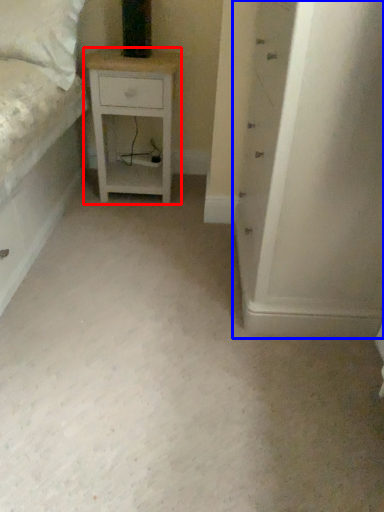
Question: Which point is closer to the camera, nightstand (highlighted by a red box) or chest of drawers (highlighted by a blue box)?

Choices:
 (A) nightstand
 (B) chest of drawers

Answer: (B)